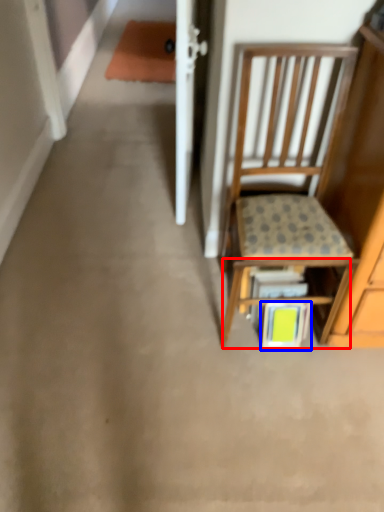
Question: Which point is closer to the camera, shelf (highlighted by a red box) or book (highlighted by a blue box)?

Choices:
 (A) shelf
 (B) book

Answer: (A)